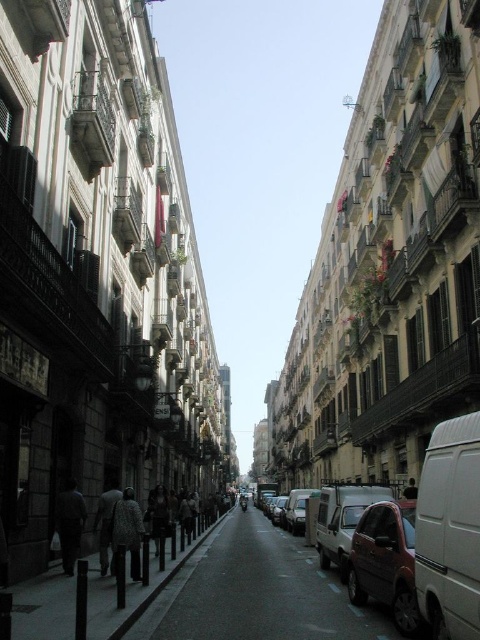
You are a pedestrian standing on the sidewalk on the left side of the street. You want to cross to the right side where the parked cars are. Which car should you walk towards first, the metallic red car at center or the matte silver car at center?

You should walk towards the matte silver car at center first because the metallic red car at center is to the right of it, so the matte silver car at center is closer to your starting position on the left side.

You are a delivery driver who needs to park your metallic red car at center on the dark asphalt road at center. Is there enough space for the car to park without overlapping the road?

The dark asphalt road at center is positioned under the metallic red car at center, meaning the car is already parked on the road. Therefore, there is sufficient space for the metallic red car at center to park without overlapping the road.